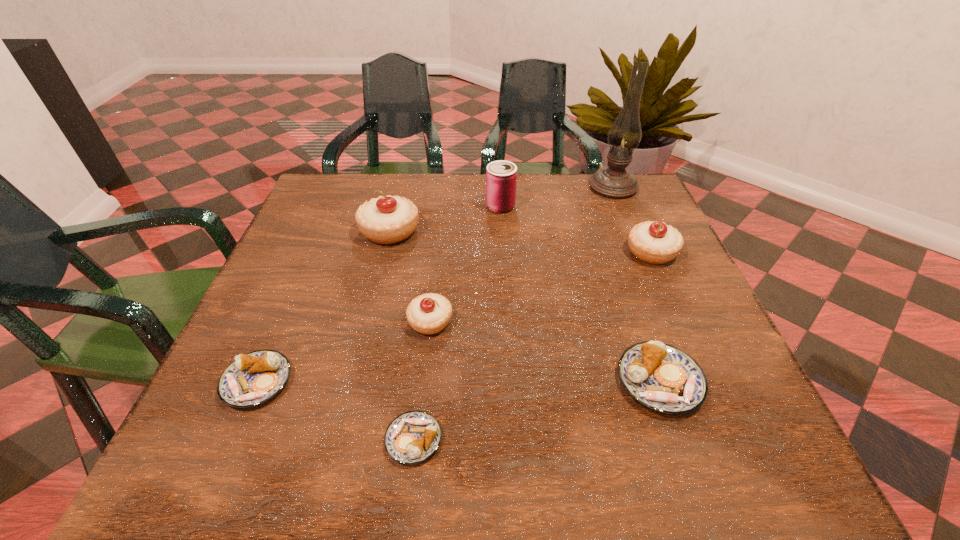
Identify the location of blank region between the second beige pastry from left to right and the third shortest object. Image resolution: width=960 pixels, height=540 pixels. (545, 352).

At what (x,y) coordinates should I click in order to perform the action: click on free spot between the shortest object and the oil lamp. Please return your answer as a coordinate pair (x, y). Looking at the image, I should click on tap(514, 313).

The image size is (960, 540). Find the location of `vacant point located between the fourth tallest pastry and the fourth nearest object`. vacant point located between the fourth tallest pastry and the fourth nearest object is located at coordinates (545, 352).

Where is `empty space between the second shortest object and the biggest brown pastry`? Image resolution: width=960 pixels, height=540 pixels. empty space between the second shortest object and the biggest brown pastry is located at coordinates (458, 381).

Identify the location of vacant region between the can and the second tallest pastry. This screenshot has width=960, height=540. (576, 229).

Select which object is the fourth closest to the shortest object. Please provide its 2D coordinates. Your answer should be formatted as a tuple, i.e. [(x, y)], where the tuple contains the x and y coordinates of a point satisfying the conditions above.

[(391, 219)]

Locate which object is the fourth closest to the leftmost beige pastry. Please provide its 2D coordinates. Your answer should be formatted as a tuple, i.e. [(x, y)], where the tuple contains the x and y coordinates of a point satisfying the conditions above.

[(413, 437)]

This screenshot has height=540, width=960. I want to click on pastry that stands as the third closest to the second shortest object, so click(391, 219).

Locate an element on the screen. The height and width of the screenshot is (540, 960). pastry that can be found as the third closest to the fifth object from left to right is located at coordinates (428, 314).

Locate which beige pastry ranks in proximity to the second brown pastry from left to right. Please provide its 2D coordinates. Your answer should be formatted as a tuple, i.e. [(x, y)], where the tuple contains the x and y coordinates of a point satisfying the conditions above.

[(428, 314)]